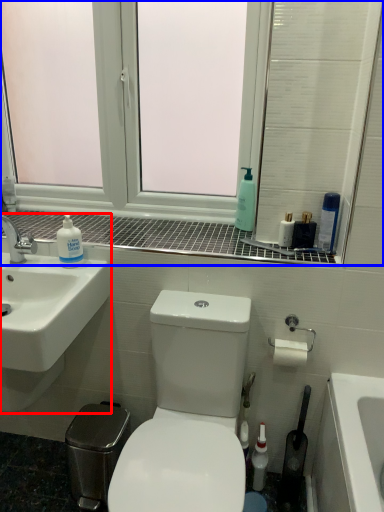
Question: Which of the following is the farthest to the observer, sink (highlighted by a red box) or window (highlighted by a blue box)?

Choices:
 (A) sink
 (B) window

Answer: (B)